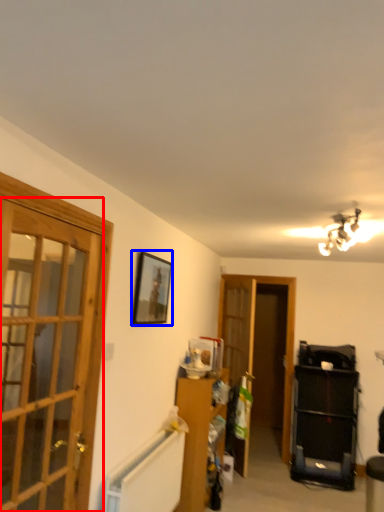
Question: Which object appears farthest to the camera in this image, door (highlighted by a red box) or picture frame (highlighted by a blue box)?

Choices:
 (A) door
 (B) picture frame

Answer: (B)